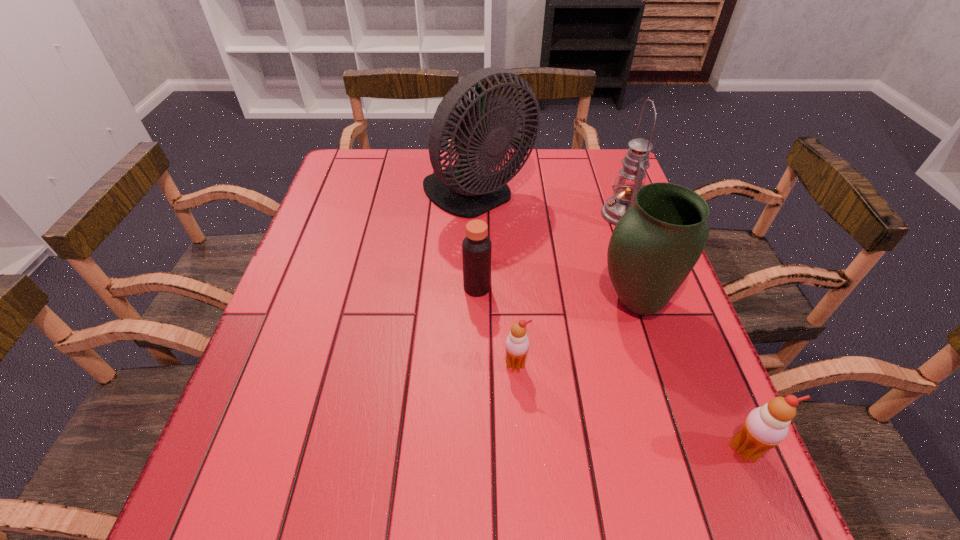
Observe the arrangement of all icecreams in the image. To keep them evenly spaced, where would you place another icecream on the left? Please locate a free space. Please provide its 2D coordinates. Your answer should be formatted as a tuple, i.e. [(x, y)], where the tuple contains the x and y coordinates of a point satisfying the conditions above.

[(341, 301)]